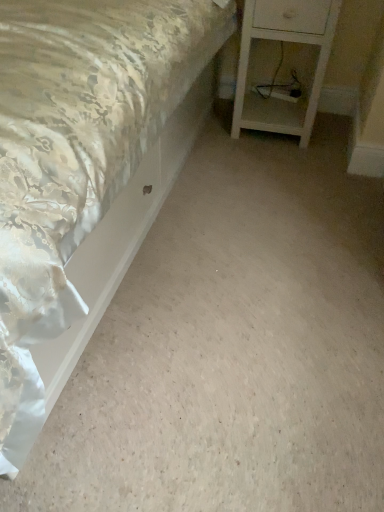
Where is `vacant area that is in front of white wood nightstand at lower right`? vacant area that is in front of white wood nightstand at lower right is located at coordinates (284, 163).